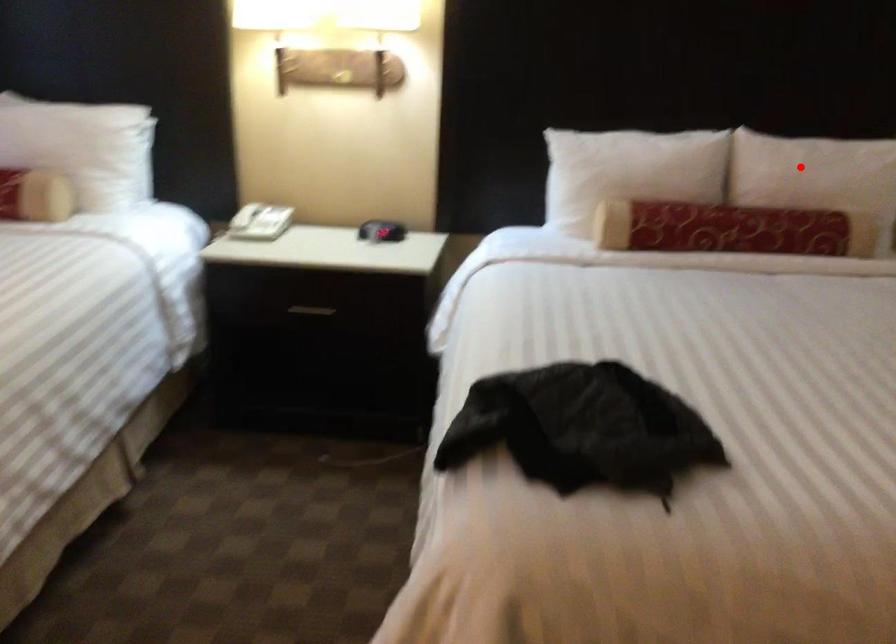
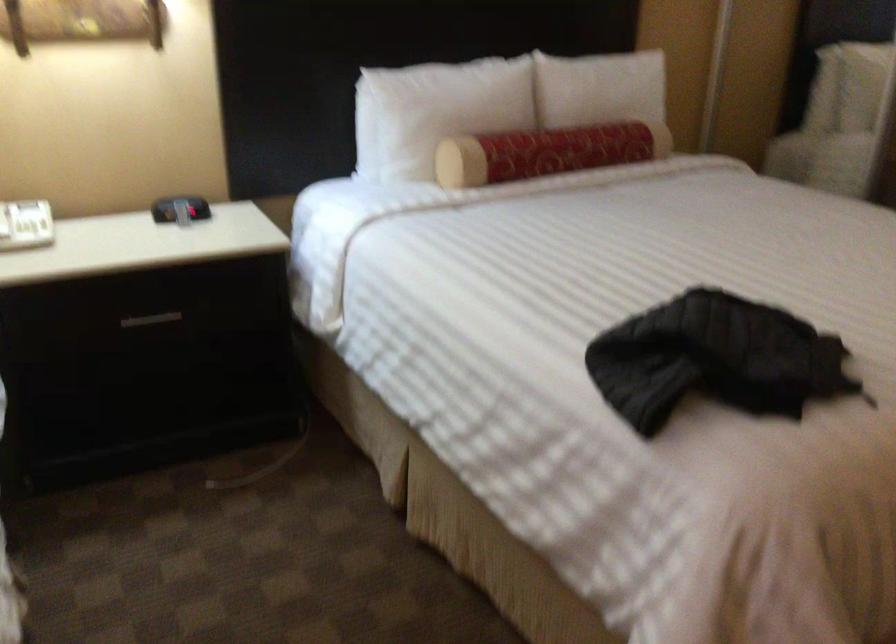
Question: I am providing you with two images of the same scene from different viewpoints. A red point is shown in image1. For the corresponding object point in image2, is it positioned nearer or farther from the camera?

Choices:
 (A) Nearer
 (B) Farther

Answer: (B)